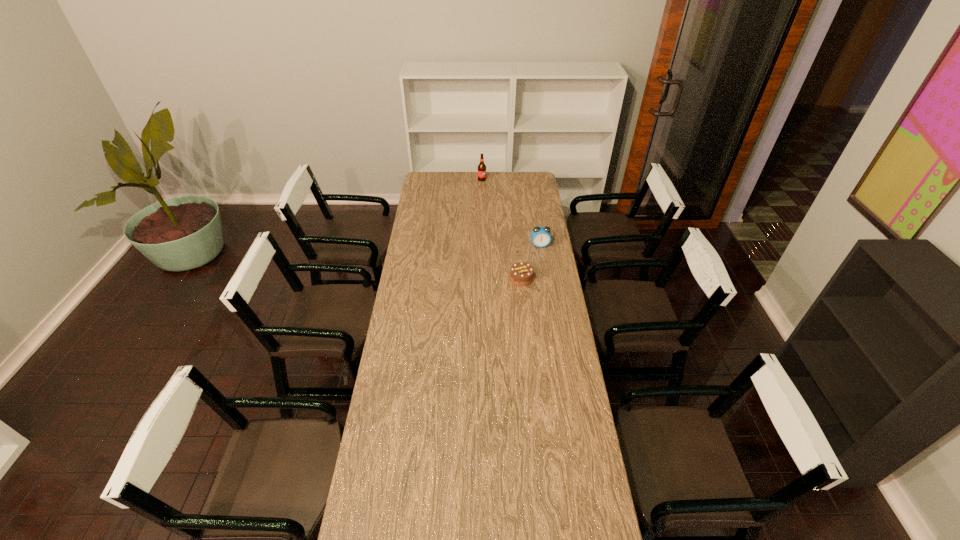
Find the location of a particular element. free space that satisfies the following two spatial constraints: 1. on the front side of the tallest object; 2. on the left side of the nearest object is located at coordinates (483, 278).